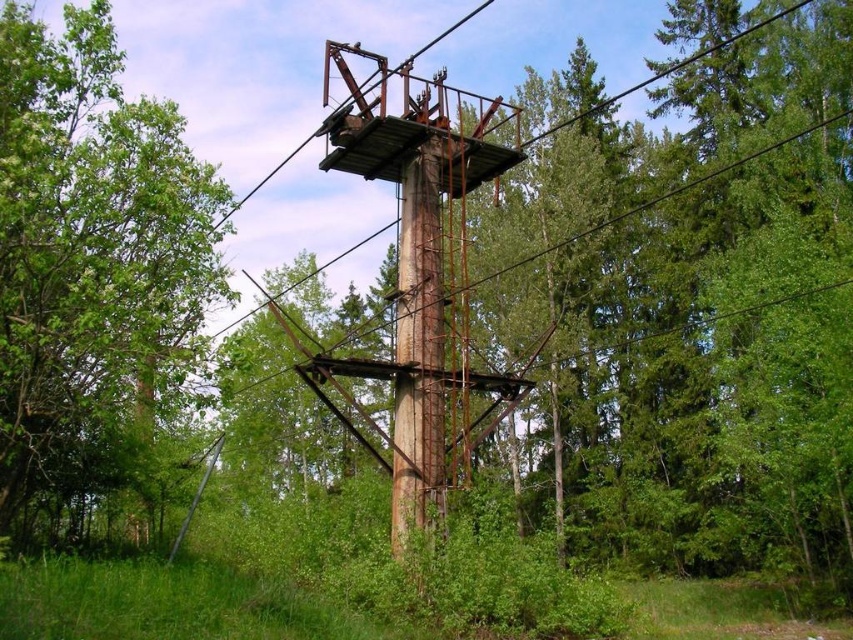
Question: In this image, where is rusty metal observation tower at center located relative to rusty metal pole at center?

Choices:
 (A) below
 (B) above

Answer: (B)

Question: Does rusty metal observation tower at center appear on the right side of rusty metal tower at center?

Choices:
 (A) yes
 (B) no

Answer: (B)

Question: Which object is closer to the camera taking this photo?

Choices:
 (A) green leafy tree at left
 (B) rusty metal observation tower at center
 (C) rusty metal tower at center

Answer: (C)

Question: Which point appears closest to the camera in this image?

Choices:
 (A) (71, 205)
 (B) (405, 173)
 (C) (543, 138)
 (D) (497, 384)

Answer: (A)

Question: Does rusty metal observation tower at center have a larger size compared to rusty metal tower at center?

Choices:
 (A) yes
 (B) no

Answer: (B)

Question: Which point is farther to the camera?

Choices:
 (A) rusty metal observation tower at center
 (B) rusty metal pole at center

Answer: (A)